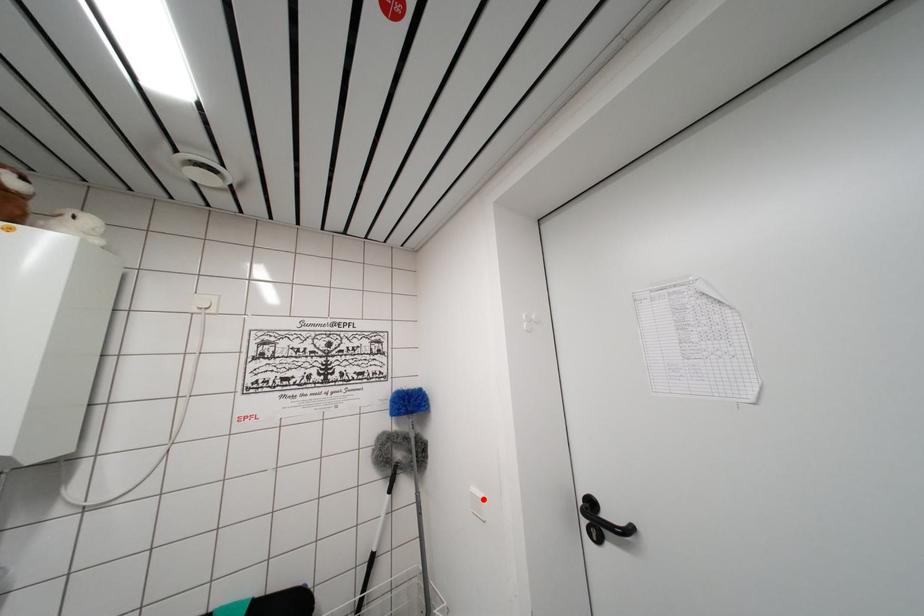
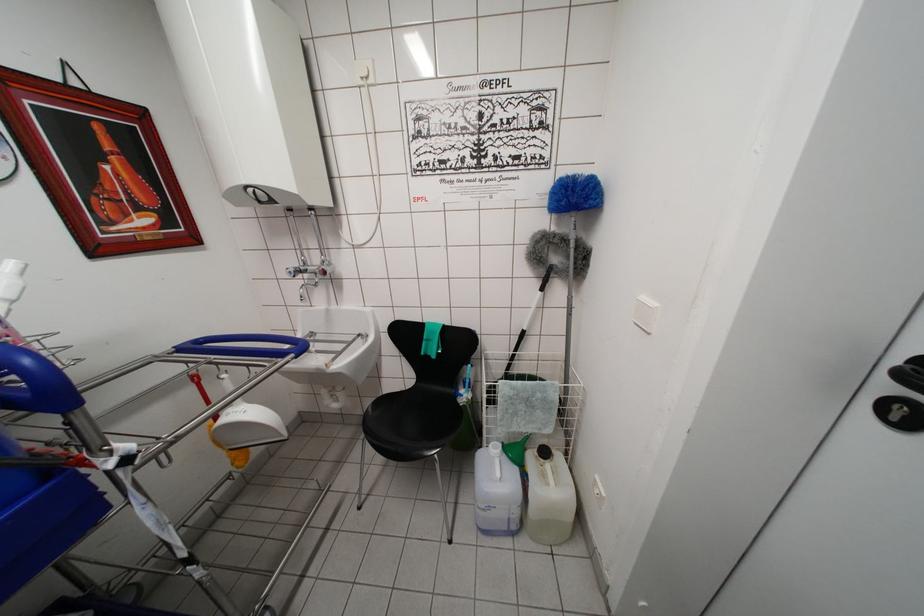
In the second image, find the point that corresponds to the highlighted location in the first image.

(657, 308)